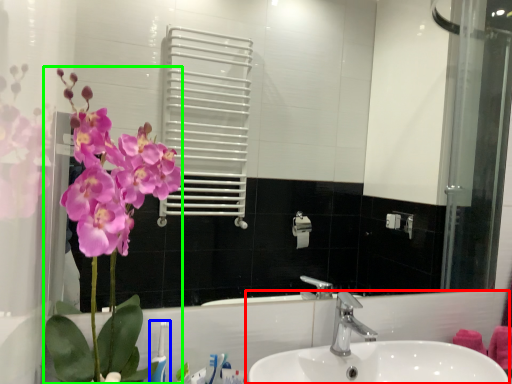
Question: Which object is the farthest from sink (highlighted by a red box)? Choose among these: toothbrush (highlighted by a blue box) or floral arrangement (highlighted by a green box).

Choices:
 (A) toothbrush
 (B) floral arrangement

Answer: (B)